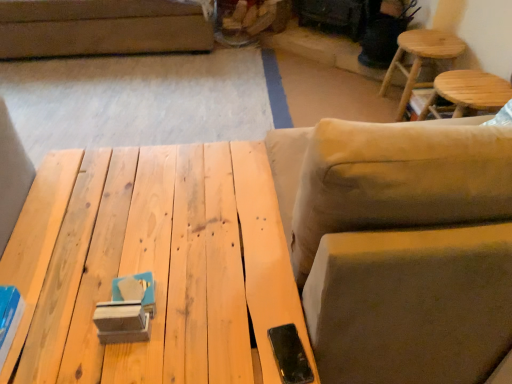
Question: In terms of height, does light brown wooden stool at upper right, acting as the 2th stool starting from the front, look taller or shorter compared to beige fabric swivel chair at right?

Choices:
 (A) short
 (B) tall

Answer: (A)

Question: From a real-world perspective, is light brown wooden stool at upper right, acting as the 2th stool starting from the front, physically located above or below beige fabric swivel chair at right?

Choices:
 (A) below
 (B) above

Answer: (A)

Question: Which object is the closest to the wooden stool at upper right, which is counted as the first stool, starting from the front?

Choices:
 (A) light brown wooden stool at upper right, acting as the 2th stool starting from the front
 (B) natural wood table at center
 (C) beige fabric swivel chair at right

Answer: (A)

Question: Which of these objects is positioned farthest from the wooden stool at upper right, which is the second stool in back-to-front order?

Choices:
 (A) natural wood table at center
 (B) light brown wooden stool at upper right, which ranks as the 1th stool in back-to-front order
 (C) beige fabric swivel chair at right

Answer: (A)